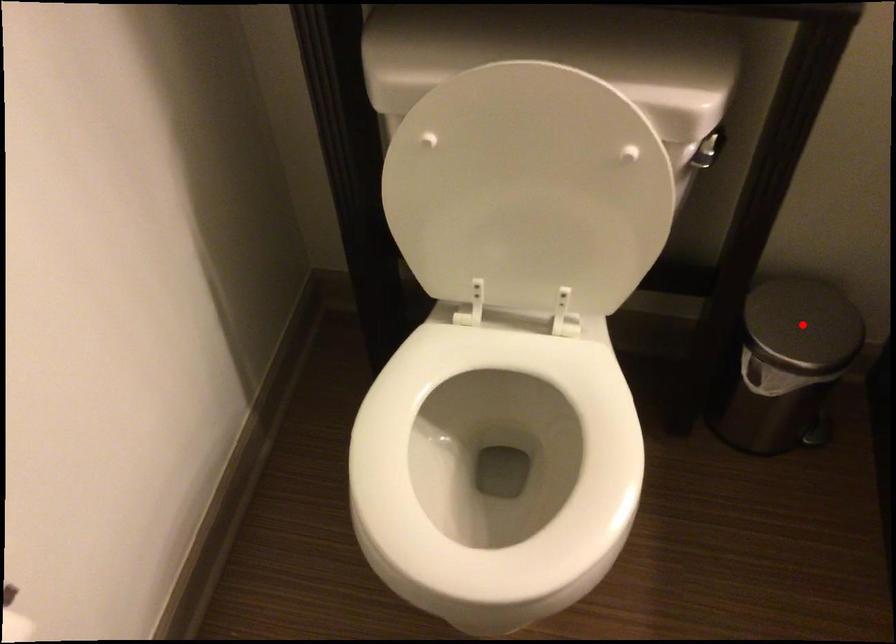
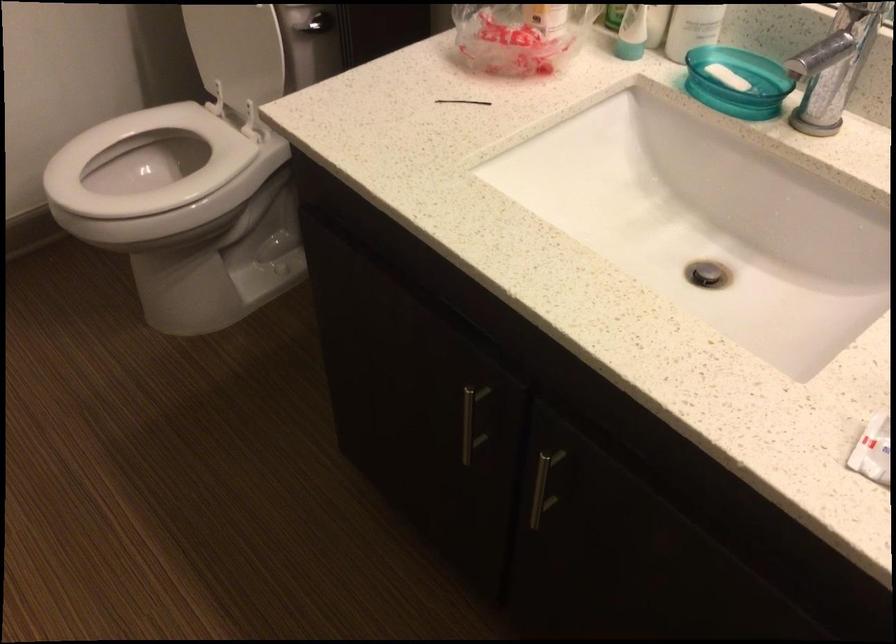
Question: I am providing you with two images of the same scene from different viewpoints. A red point is marked on the first image. Is the red point's position out of view in image 2?

Choices:
 (A) Yes
 (B) No

Answer: (A)